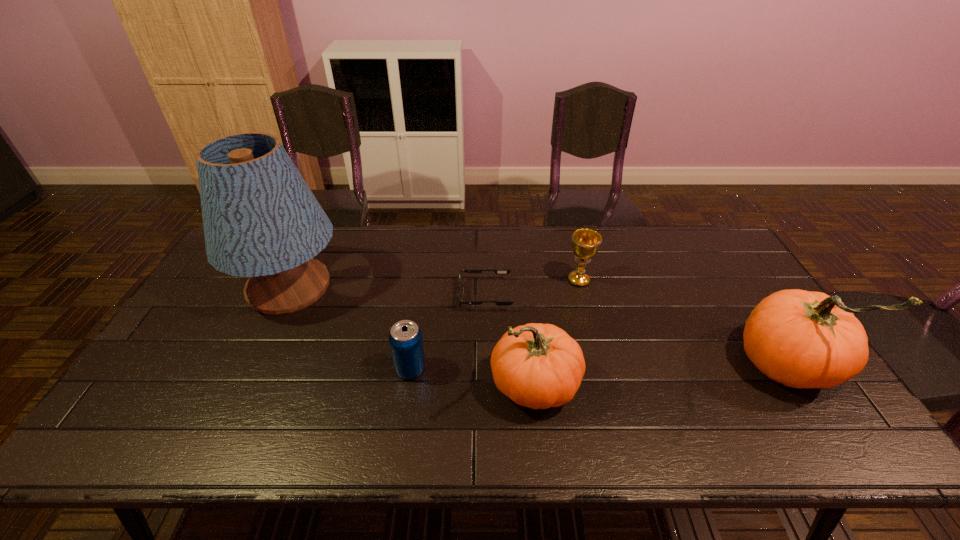
This screenshot has height=540, width=960. I want to click on vacant spot to place a pumpkin on the left, so click(261, 407).